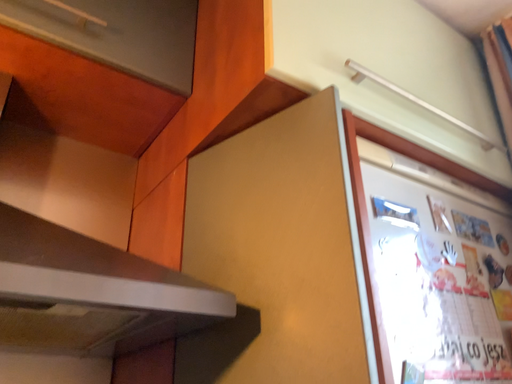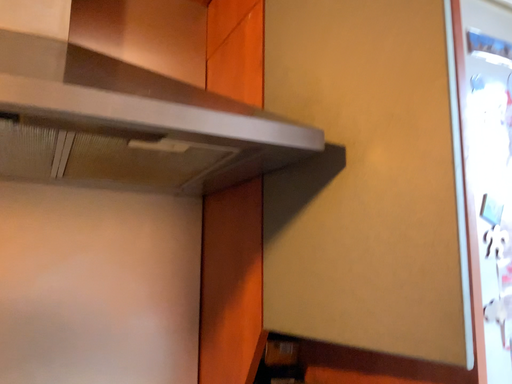
Question: How did the camera likely rotate when shooting the video?

Choices:
 (A) rotated downward
 (B) rotated upward

Answer: (A)